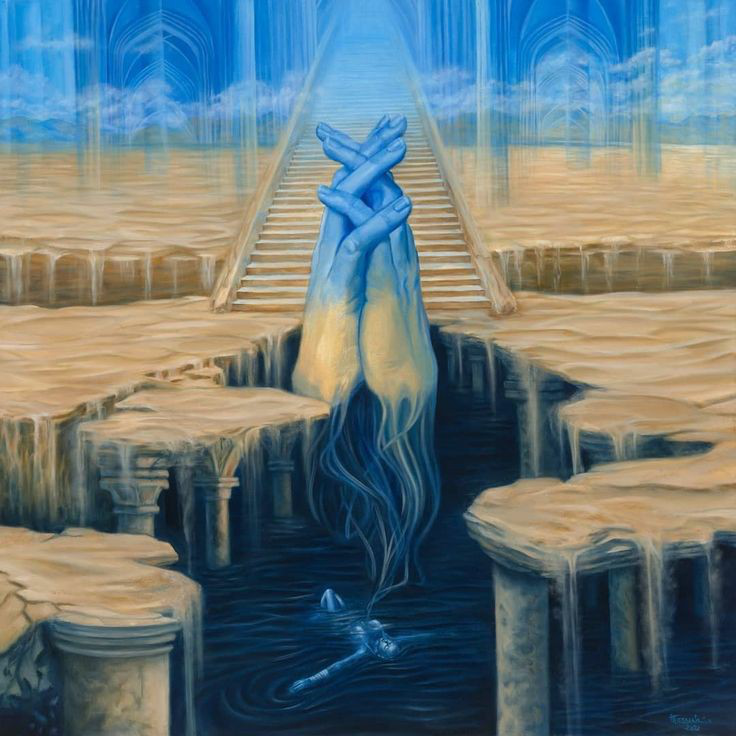
Find the location of `pillars`. pillars is located at coordinates (127, 686), (511, 686), (620, 637), (146, 495), (224, 509), (283, 488).